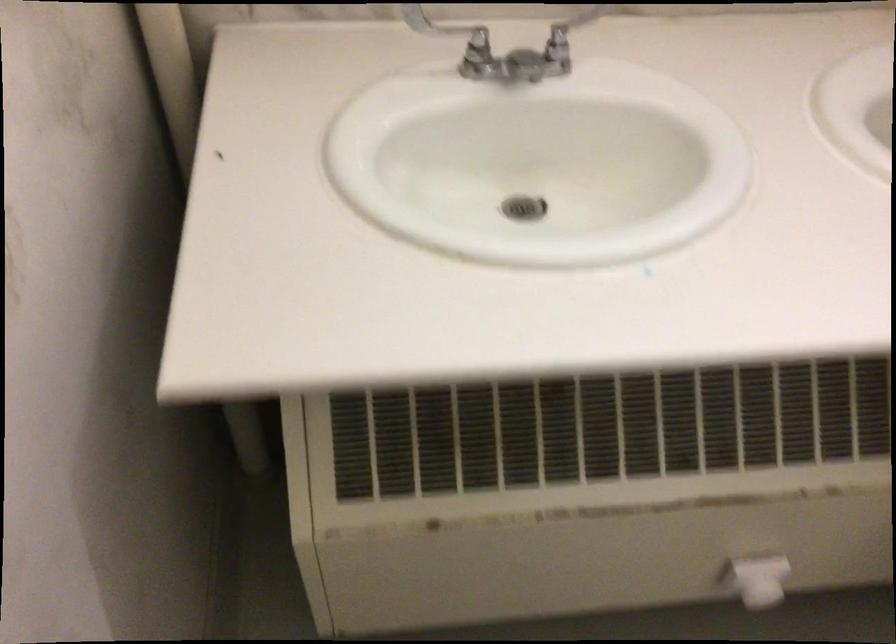
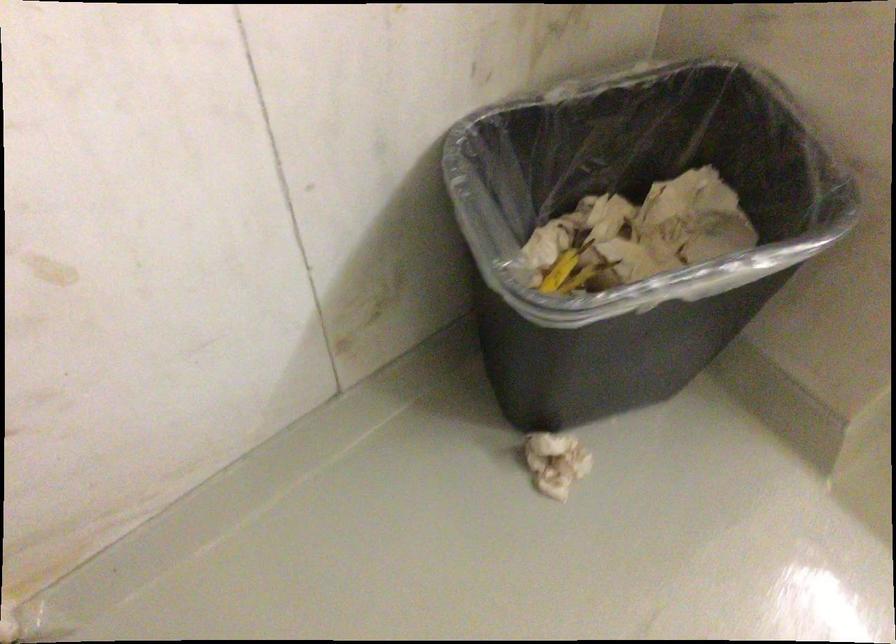
The images are taken continuously from a first-person perspective. In which direction is your viewpoint rotating?

The camera rotated toward left-down.